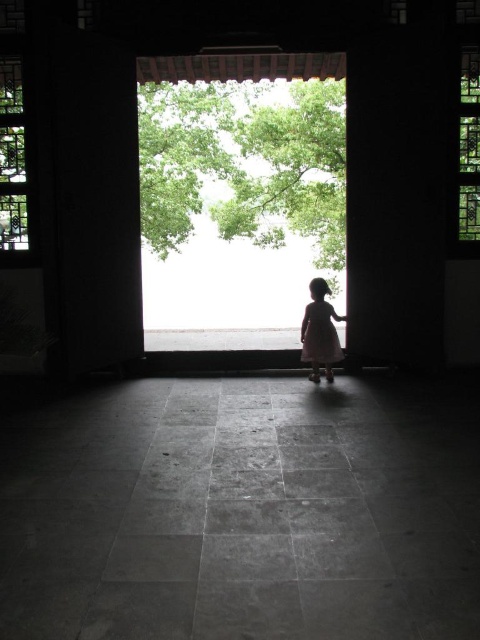
You are standing inside the traditional Chinese building and want to know how far you are from the point marked at coordinates (468, 227). Can you determine the distance?

The point marked at coordinates (468, 227) is 5.79 meters away from your current position inside the traditional Chinese building.

You are an interior designer planning to install a new light fixture. You have two options based on the existing windows. Which window, the translucent glass window at left or the green stained glass window at upper right, allows more natural light into the room due to its height?

The translucent glass window at left allows more natural light into the room because it has a greater height compared to the green stained glass window at upper right.